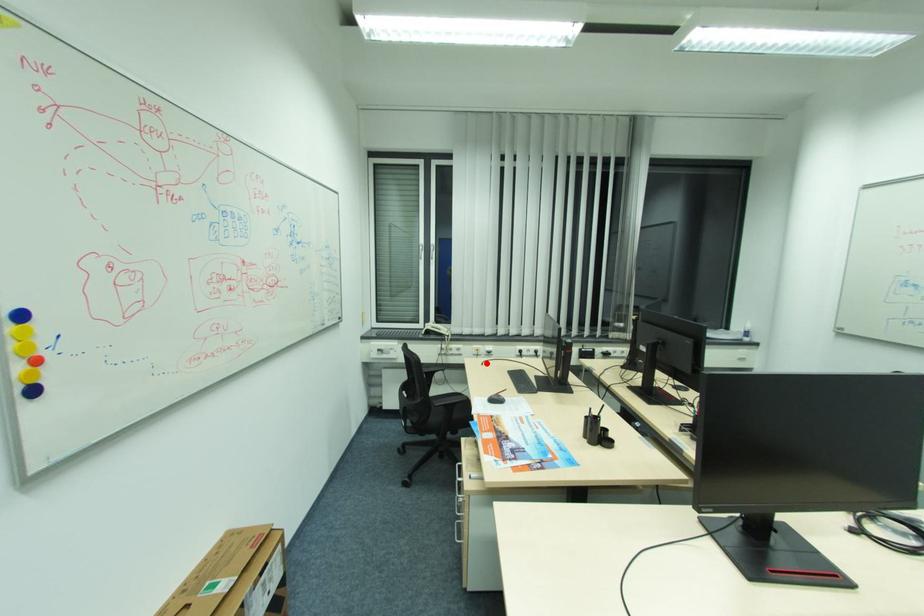
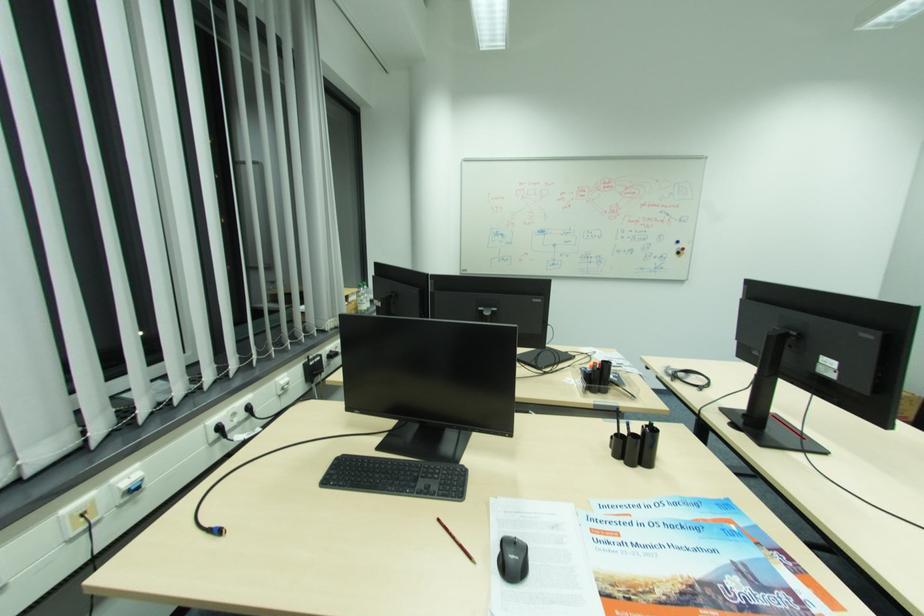
Find the pixel in the second image that matches the highlighted location in the first image.

(209, 533)